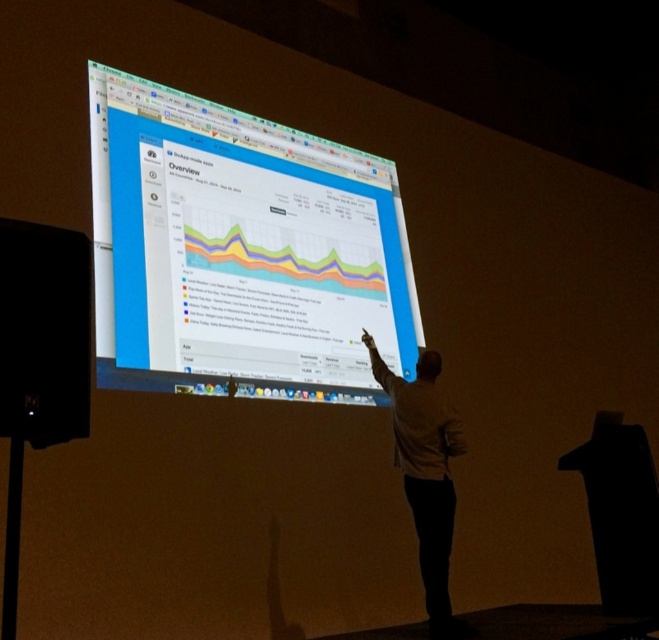
You are an attendee at the presentation and want to take a photo of the matte black monitor at center and the white matte shirt at center. Which object should you focus on first to ensure both are in the frame?

The matte black monitor at center is wider than the white matte shirt at center, so you should focus on the matte black monitor at center first to ensure both are in the frame.

You are attending a presentation and want to adjust the volume of the black matte speaker at lower left. You are currently standing 1.8 meters away from it. Can you reach the speaker to adjust the volume?

The black matte speaker at lower left is 2.10 meters away from viewer. Since you are standing 1.8 meters away, you are closer than the speaker, so you can reach it to adjust the volume.